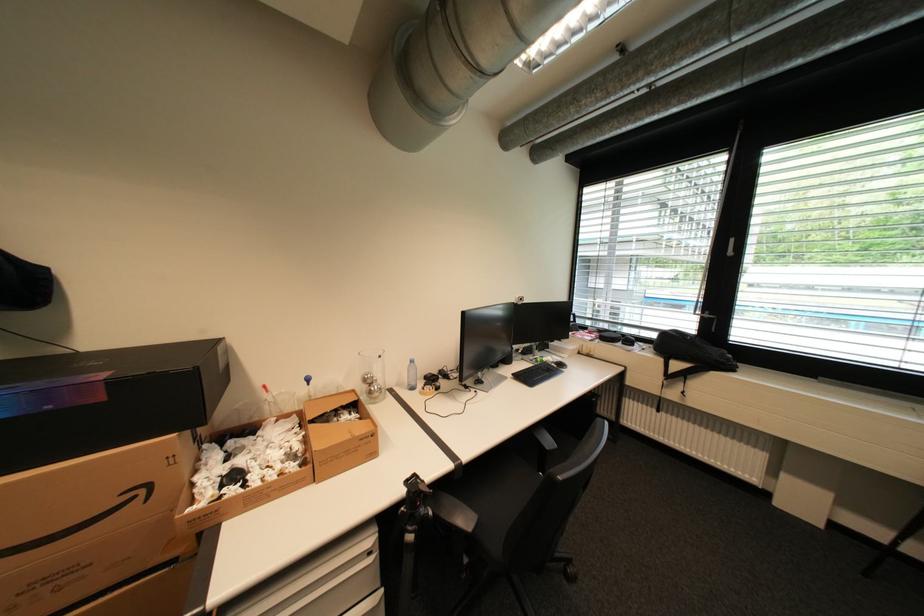
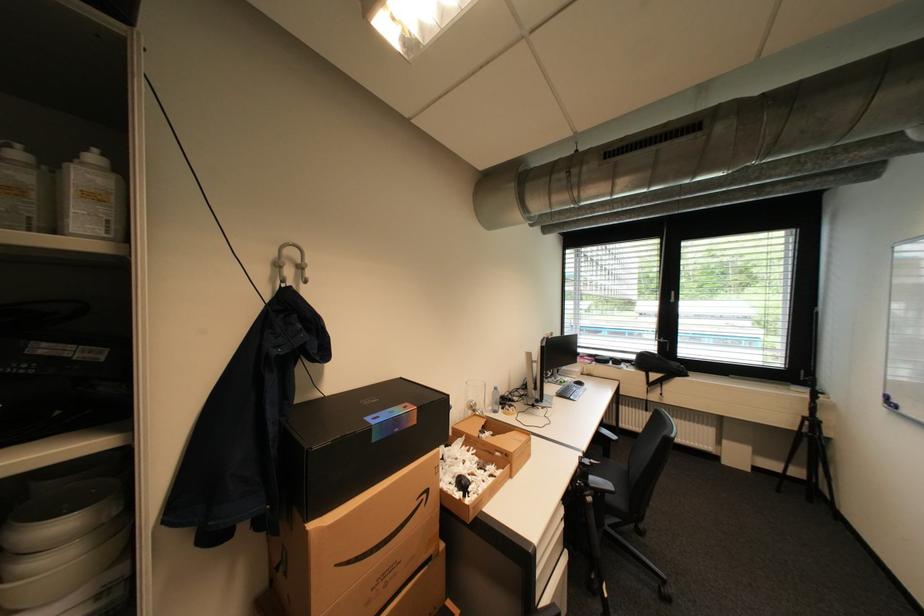
In the second image, find the point that corresponds to the point at 151,491 in the first image.

(433, 496)